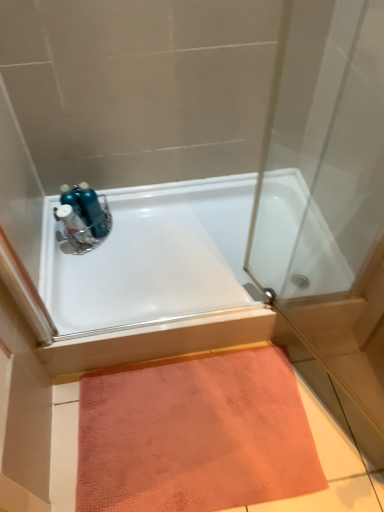
I want to click on free space in front of blue metallic bottles at upper left, so click(101, 259).